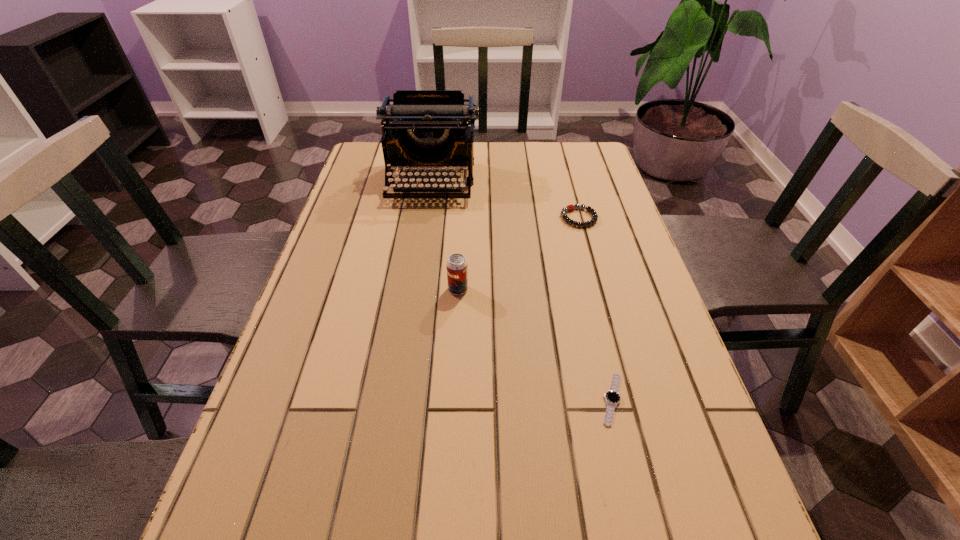
Image resolution: width=960 pixels, height=540 pixels. I want to click on vacant space that is in between the second tallest object and the typewriter, so click(444, 235).

Find the location of `empty space between the beer can and the watch`. empty space between the beer can and the watch is located at coordinates (535, 344).

You are a GUI agent. You are given a task and a screenshot of the screen. Output one action in this format:
    pyautogui.click(x=<x>, y=<y>)
    Task: Click on the free space that is in between the third farthest object and the bracelet
    The width and height of the screenshot is (960, 540).
    Given the screenshot: What is the action you would take?
    pyautogui.click(x=518, y=254)

At what (x,y) coordinates should I click in order to perform the action: click on empty location between the typewriter and the watch. Please return your answer as a coordinate pair (x, y). Image resolution: width=960 pixels, height=540 pixels. Looking at the image, I should click on (522, 291).

Locate an element on the screen. This screenshot has height=540, width=960. free space between the typewriter and the beer can is located at coordinates (444, 235).

Find the location of a particular element. This screenshot has width=960, height=540. blank region between the beer can and the second shortest object is located at coordinates (518, 254).

Where is `free space that is in between the farthest object and the third farthest object`? This screenshot has width=960, height=540. free space that is in between the farthest object and the third farthest object is located at coordinates (444, 235).

Where is `vacant space in between the third nearest object and the tallest object`? This screenshot has width=960, height=540. vacant space in between the third nearest object and the tallest object is located at coordinates (505, 200).

Locate an element on the screen. Image resolution: width=960 pixels, height=540 pixels. unoccupied position between the second farthest object and the farthest object is located at coordinates (505, 200).

You are a GUI agent. You are given a task and a screenshot of the screen. Output one action in this format:
    pyautogui.click(x=<x>, y=<y>)
    Task: Click on the vacant region between the third shortest object and the shortest object
    Image resolution: width=960 pixels, height=540 pixels.
    Given the screenshot: What is the action you would take?
    pyautogui.click(x=535, y=344)